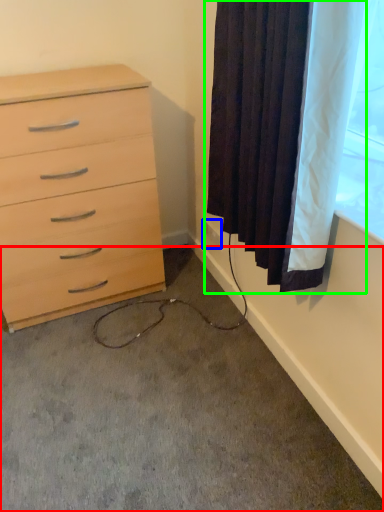
Question: Which object is positioned farthest from concrete (highlighted by a red box)? Select from electric outlet (highlighted by a blue box) and curtain (highlighted by a green box).

Choices:
 (A) electric outlet
 (B) curtain

Answer: (A)